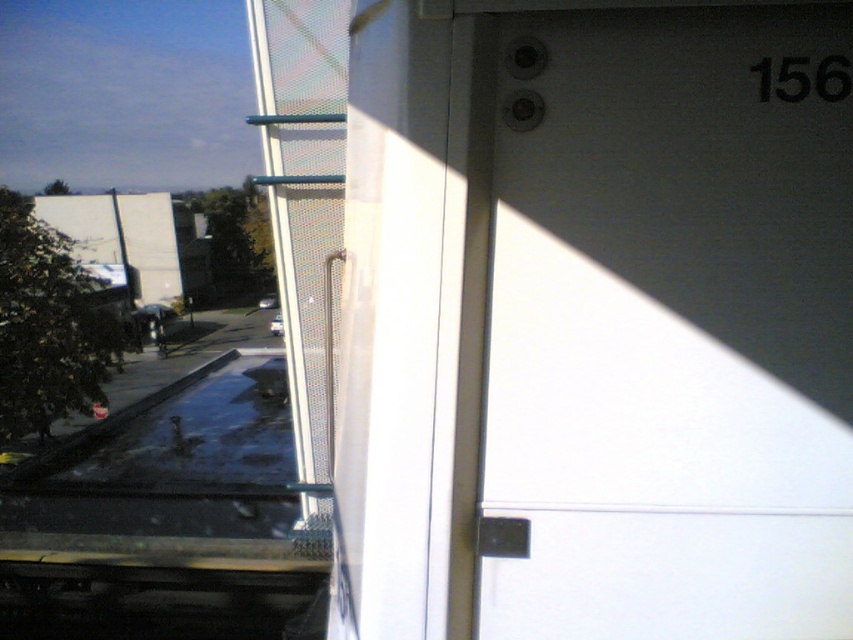
Between white matte door at upper right and transparent glass pool at lower left, which one is positioned lower?

transparent glass pool at lower left

Does white matte door at upper right have a larger size compared to transparent glass pool at lower left?

No, white matte door at upper right is not bigger than transparent glass pool at lower left.

Who is more forward, [787,424] or [169,468]?

Positioned in front is point [787,424].

Locate an element on the screen. The width and height of the screenshot is (853, 640). white matte door at upper right is located at coordinates (671, 324).